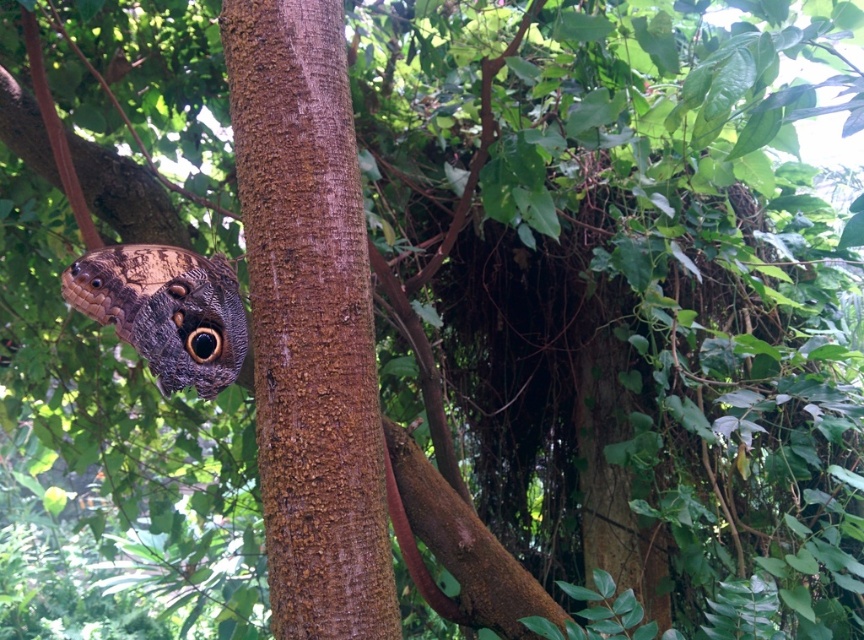
Can you confirm if brown rough bark at center is thinner than camouflage-patterned butterfly at center?

No, brown rough bark at center is not thinner than camouflage-patterned butterfly at center.

Which is in front, point (348, 525) or point (216, 269)?

Point (348, 525)

Is point (324, 604) positioned after point (169, 288)?

No, it is not.

Find the location of a particular element. The height and width of the screenshot is (640, 864). brown rough bark at center is located at coordinates pos(309,321).